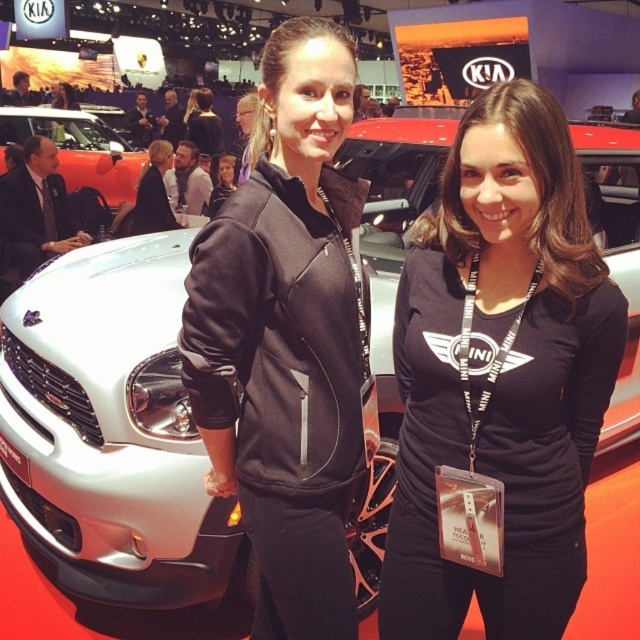
Question: Which point is closer to the camera?

Choices:
 (A) (81, 136)
 (B) (301, 472)
 (C) (493, 97)

Answer: (C)

Question: Is black jersey at center to the left of matte black hoodie at center from the viewer's perspective?

Choices:
 (A) yes
 (B) no

Answer: (B)

Question: Which of the following is the closest to the observer?

Choices:
 (A) orange matte car at center
 (B) black matte tracksuit at center

Answer: (B)

Question: Is orange matte car at center positioned behind matte black hoodie at center?

Choices:
 (A) yes
 (B) no

Answer: (A)

Question: Which point appears farthest from the camera in this image?

Choices:
 (A) (208, 216)
 (B) (54, 122)

Answer: (B)

Question: Does black matte tracksuit at center appear over matte black hoodie at center?

Choices:
 (A) no
 (B) yes

Answer: (A)